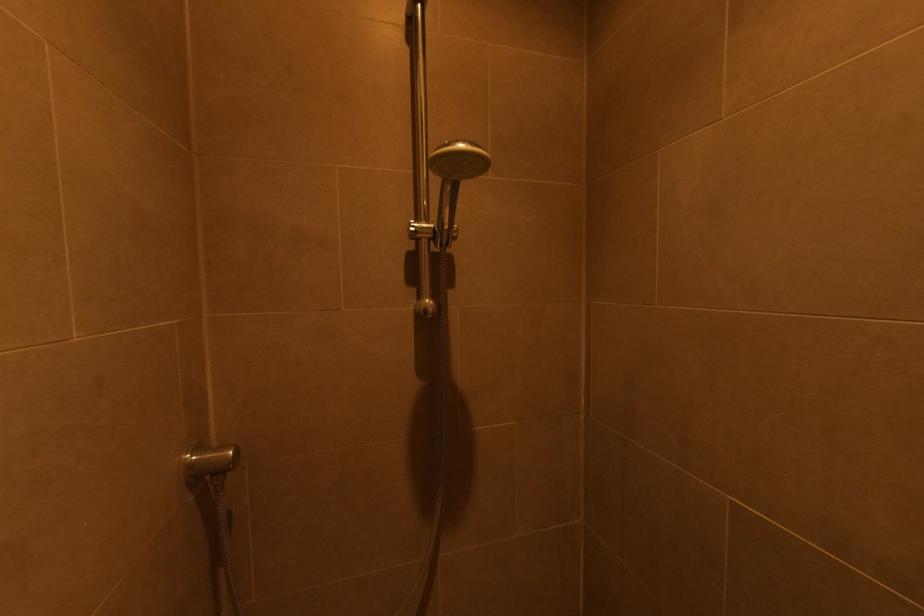
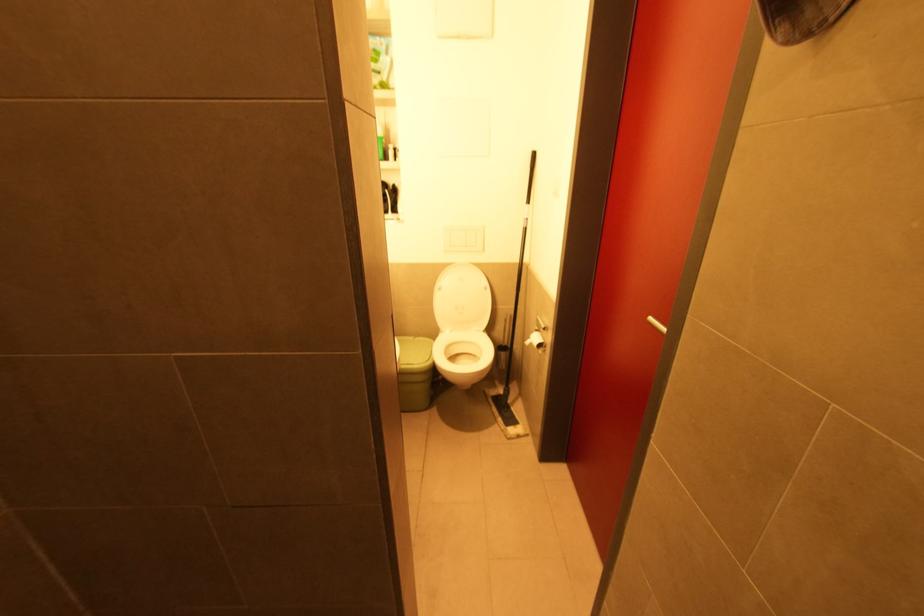
The images are taken continuously from a first-person perspective. In which direction is your viewpoint rotating?

The camera's rotation is toward right-down.